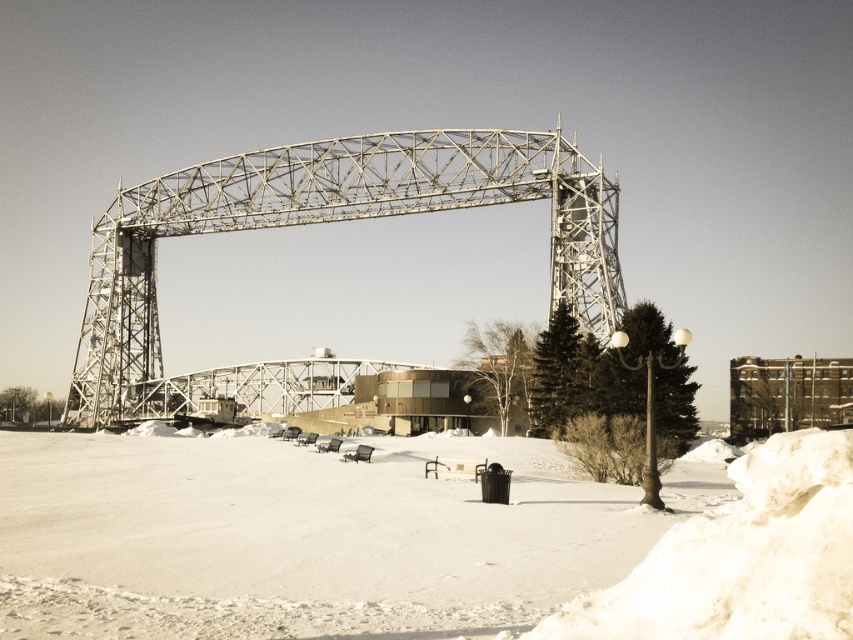
You are standing on the white powdery snow at lower left and want to walk to the metallic gray bridge at center. Which direction should you move relative to the bridge?

You should move towards the metallic gray bridge at center, as the white powdery snow at lower left is in front of it, meaning the bridge is behind the snow from your current position.

You are a snowplow operator who needs to clear the snow from the area. Based on the image, which area should you prioritize first, the white powdery snow at lower left or the metallic gray bridge at center?

The white powdery snow at lower left might be wider than the metallic gray bridge at center, so you should prioritize clearing the snow from the white powdery snow at lower left first to ensure it is manageable.